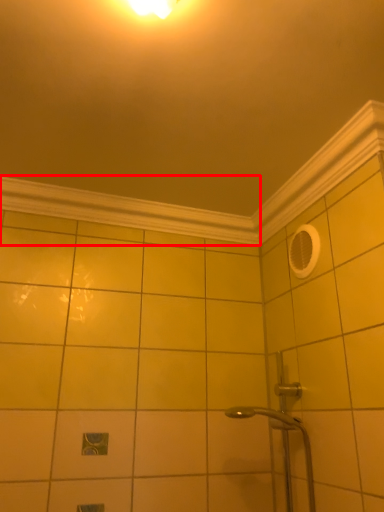
Question: In this image, where is molding (annotated by the red box) located relative to molding?

Choices:
 (A) left
 (B) right

Answer: (A)